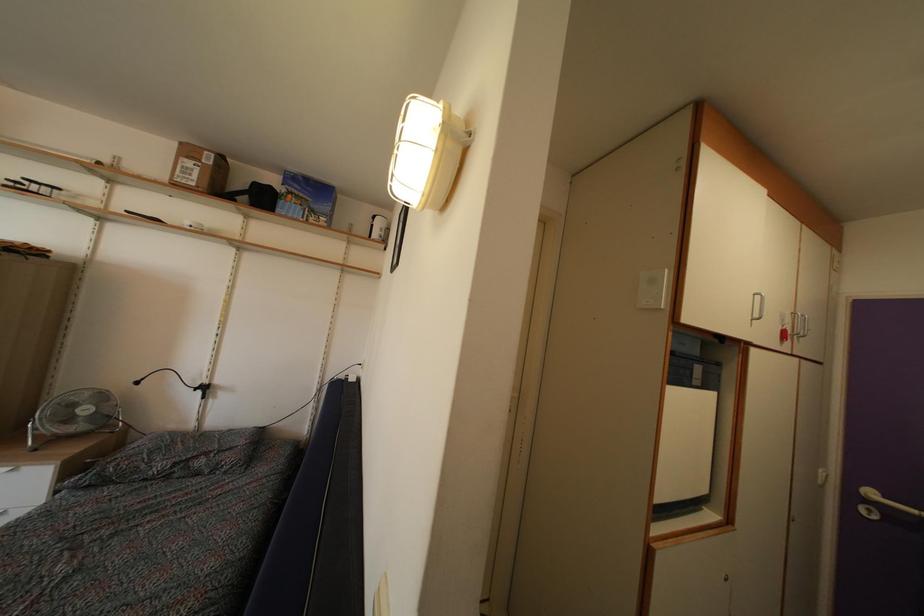
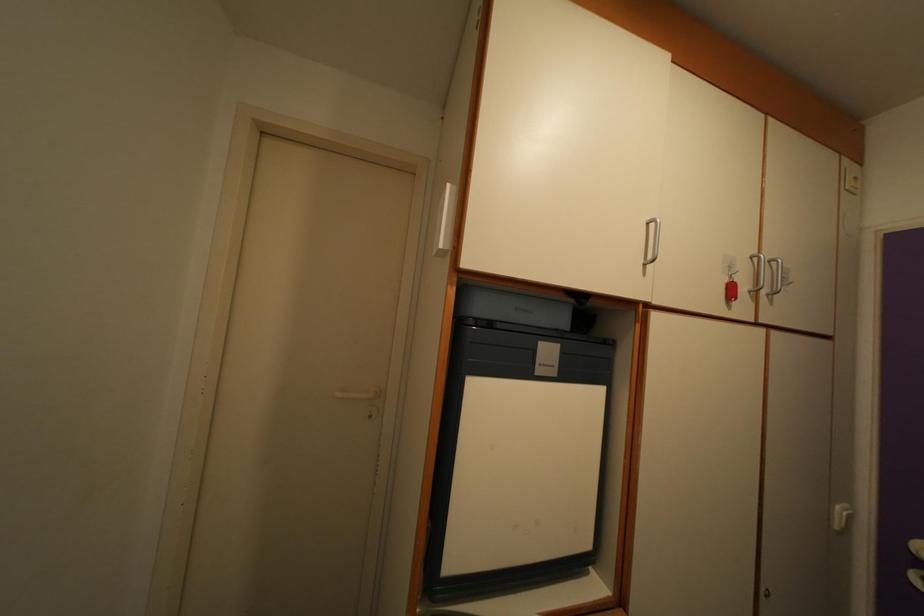
In the second image, find the point that corresponds to point 786,341 in the first image.

(735, 294)